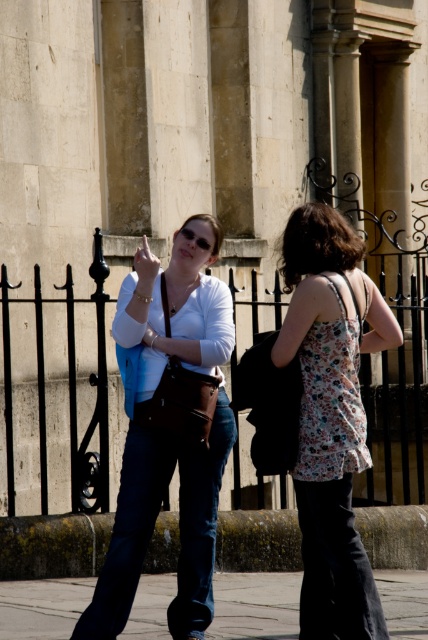
You are standing in front of the historic stone building and notice the floral fabric tank top at center. Can you determine its exact coordinates in the image?

The floral fabric tank top at center is located at point (332, 416).

You are a photographer trying to capture a detailed shot of the historic building. You notice the floral fabric tank top at center and the concrete pavement at lower center in your frame. Which object should you focus on if you want to ensure the background remains sharp? Explain your reasoning.

You should focus on the concrete pavement at lower center because it is thicker than the floral fabric tank top at center, allowing for a deeper depth of field and keeping the background sharper.